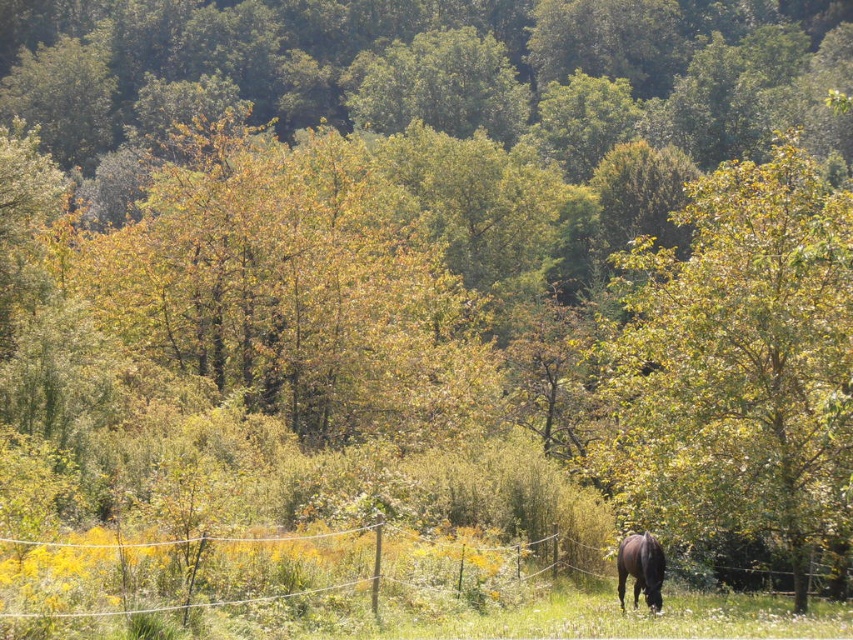
Between green leafy tree at center and black glossy horse at lower right, which one appears on the left side from the viewer's perspective?

Positioned to the left is black glossy horse at lower right.

Is green leafy tree at center to the right of black glossy horse at lower right from the viewer's perspective?

Correct, you'll find green leafy tree at center to the right of black glossy horse at lower right.

This screenshot has height=640, width=853. I want to click on green leafy tree at center, so click(740, 365).

The height and width of the screenshot is (640, 853). I want to click on green leafy tree at center, so click(x=740, y=365).

How much distance is there between wire mesh at lower right and black glossy horse at lower right?

wire mesh at lower right is 2.65 meters away from black glossy horse at lower right.

Is wire mesh at lower right shorter than black glossy horse at lower right?

In fact, wire mesh at lower right may be taller than black glossy horse at lower right.

Describe the element at coordinates (251, 596) in the screenshot. I see `wire mesh at lower right` at that location.

Where is `wire mesh at lower right`? The image size is (853, 640). wire mesh at lower right is located at coordinates (251, 596).

Who is taller, green leafy tree at center or wire mesh at lower right?

With more height is green leafy tree at center.

Who is more distant from viewer, [776,316] or [412,586]?

The point [776,316] is more distant.

Identify the location of green leafy tree at center. The width and height of the screenshot is (853, 640). (740, 365).